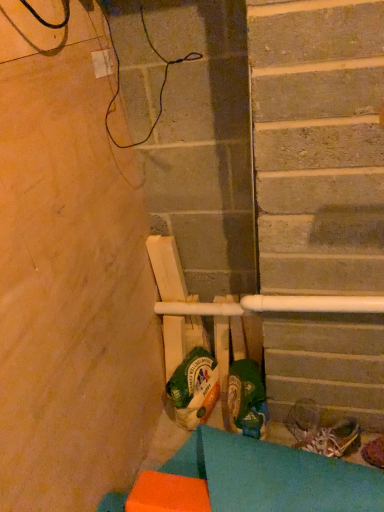
Describe the element at coordinates (246, 398) in the screenshot. I see `green fabric shoe at center, the 3th footwear when ordered from right to left` at that location.

The width and height of the screenshot is (384, 512). I want to click on orange foam block at lower left, so click(x=274, y=476).

You are a GUI agent. You are given a task and a screenshot of the screen. Output one action in this format:
    pyautogui.click(x=<x>, y=<y>)
    Task: Click on the green fabric shoe at center, the 3th footwear when ordered from right to left
    The image size is (384, 512).
    Given the screenshot: What is the action you would take?
    pyautogui.click(x=246, y=398)

Could you tell me if green fabric shoe at center, the 1th footwear viewed from the left, is facing shiny metallic shoe at lower right, the third footwear in the left-to-right sequence?

No, green fabric shoe at center, the 1th footwear viewed from the left, is not facing towards shiny metallic shoe at lower right, the third footwear in the left-to-right sequence.

Considering the points (249, 396) and (374, 453), which point is behind, point (249, 396) or point (374, 453)?

The point (374, 453) is more distant.

From the image's perspective, which one is positioned higher, green fabric shoe at center, the 1th footwear viewed from the left, or shiny metallic shoe at lower right, the third footwear in the left-to-right sequence?

From the image's view, green fabric shoe at center, the 1th footwear viewed from the left, is above.

I want to click on the 2nd footwear above the shiny metallic shoe at lower right, the third footwear in the left-to-right sequence (from a real-world perspective), so click(246, 398).

From a real-world perspective, does shiny metallic shoes at lower right, the 2th footwear in the right-to-left sequence, sit lower than orange foam block at lower left?

Indeed, from a real-world perspective, shiny metallic shoes at lower right, the 2th footwear in the right-to-left sequence, is positioned beneath orange foam block at lower left.

Between point (309, 445) and point (290, 495), which one is positioned behind?

The point (309, 445) is farther.

Does green fabric shoe at center, the 1th footwear viewed from the left, have a greater height compared to orange foam block at lower left?

Yes.

Between green fabric shoe at center, the 1th footwear viewed from the left, and orange foam block at lower left, which one has larger width?

With larger width is orange foam block at lower left.

Relative to orange foam block at lower left, is green fabric shoe at center, the 1th footwear viewed from the left, in front or behind?

In the image, green fabric shoe at center, the 1th footwear viewed from the left, appears behind orange foam block at lower left.

Is orange foam block at lower left a part of green fabric shoe at center, the 3th footwear when ordered from right to left?

No, orange foam block at lower left is not surrounded by green fabric shoe at center, the 3th footwear when ordered from right to left.

Is green fabric shoe at center, the 3th footwear when ordered from right to left, at the back of shiny metallic shoes at lower right, the 2th footwear in the right-to-left sequence?

No, shiny metallic shoes at lower right, the 2th footwear in the right-to-left sequence, is not facing the opposite direction of green fabric shoe at center, the 3th footwear when ordered from right to left.

Identify the location of footwear to the left of shiny metallic shoes at lower right, the 2th footwear positioned from the left. (246, 398).

From a real-world perspective, which object rests below the other?

shiny metallic shoes at lower right, the 2th footwear in the right-to-left sequence, is physically lower.

Does shiny metallic shoes at lower right, the 2th footwear positioned from the left, appear on the right side of green fabric shoe at center, the 1th footwear viewed from the left?

Correct, you'll find shiny metallic shoes at lower right, the 2th footwear positioned from the left, to the right of green fabric shoe at center, the 1th footwear viewed from the left.

Is shiny metallic shoes at lower right, the 2th footwear in the right-to-left sequence, completely or partially inside shiny metallic shoe at lower right, which is counted as the first footwear, starting from the right?

No, shiny metallic shoe at lower right, which is counted as the first footwear, starting from the right, does not contain shiny metallic shoes at lower right, the 2th footwear in the right-to-left sequence.

Is shiny metallic shoe at lower right, which is counted as the first footwear, starting from the right, in contact with shiny metallic shoes at lower right, the 2th footwear in the right-to-left sequence?

No, shiny metallic shoe at lower right, which is counted as the first footwear, starting from the right, is not beside shiny metallic shoes at lower right, the 2th footwear in the right-to-left sequence.

Which is less distant, (364, 457) or (327, 429)?

Positioned in front is point (364, 457).

Is point (233, 401) less distant than point (320, 440)?

No.

From a real-world perspective, which object stands above the other?

In real-world perspective, green fabric shoe at center, the 3th footwear when ordered from right to left, is above.

Considering the sizes of green fabric shoe at center, the 3th footwear when ordered from right to left, and shiny metallic shoes at lower right, the 2th footwear positioned from the left, in the image, is green fabric shoe at center, the 3th footwear when ordered from right to left, bigger or smaller than shiny metallic shoes at lower right, the 2th footwear positioned from the left,?

green fabric shoe at center, the 3th footwear when ordered from right to left, is bigger than shiny metallic shoes at lower right, the 2th footwear positioned from the left.

In the scene shown: Does green fabric shoe at center, the 3th footwear when ordered from right to left, have a greater height compared to shiny metallic shoes at lower right, the 2th footwear positioned from the left?

Indeed, green fabric shoe at center, the 3th footwear when ordered from right to left, has a greater height compared to shiny metallic shoes at lower right, the 2th footwear positioned from the left.

Between shiny metallic shoe at lower right, the third footwear in the left-to-right sequence, and orange foam block at lower left, which one has smaller size?

Smaller between the two is shiny metallic shoe at lower right, the third footwear in the left-to-right sequence.

Is shiny metallic shoe at lower right, the third footwear in the left-to-right sequence, completely or partially outside of orange foam block at lower left?

Absolutely, shiny metallic shoe at lower right, the third footwear in the left-to-right sequence, is external to orange foam block at lower left.

Can you confirm if shiny metallic shoe at lower right, the third footwear in the left-to-right sequence, is shorter than orange foam block at lower left?

Correct, shiny metallic shoe at lower right, the third footwear in the left-to-right sequence, is not as tall as orange foam block at lower left.

Considering the sizes of objects shiny metallic shoe at lower right, which is counted as the first footwear, starting from the right, and orange foam block at lower left in the image provided, who is thinner, shiny metallic shoe at lower right, which is counted as the first footwear, starting from the right, or orange foam block at lower left?

With smaller width is shiny metallic shoe at lower right, which is counted as the first footwear, starting from the right.

You are a GUI agent. You are given a task and a screenshot of the screen. Output one action in this format:
    pyautogui.click(x=<x>, y=<y>)
    Task: Click on the footwear that is the 2nd one when counting leftward from the shiny metallic shoe at lower right, which is counted as the first footwear, starting from the right
    
    Given the screenshot: What is the action you would take?
    pyautogui.click(x=246, y=398)

Identify the location of footwear that is the 2nd one when counting rightward from the orange foam block at lower left. (320, 431).

From the image, which object appears to be nearer to shiny metallic shoes at lower right, the 2th footwear positioned from the left, orange foam block at lower left or shiny metallic shoe at lower right, the third footwear in the left-to-right sequence?

Among the two, shiny metallic shoe at lower right, the third footwear in the left-to-right sequence, is located nearer to shiny metallic shoes at lower right, the 2th footwear positioned from the left.

Estimate the real-world distances between objects in this image. Which object is closer to shiny metallic shoe at lower right, the third footwear in the left-to-right sequence, shiny metallic shoes at lower right, the 2th footwear in the right-to-left sequence, or orange foam block at lower left?

Among the two, shiny metallic shoes at lower right, the 2th footwear in the right-to-left sequence, is located nearer to shiny metallic shoe at lower right, the third footwear in the left-to-right sequence.

When comparing their distances from shiny metallic shoes at lower right, the 2th footwear in the right-to-left sequence, does green fabric shoe at center, the 3th footwear when ordered from right to left, or orange foam block at lower left seem closer?

green fabric shoe at center, the 3th footwear when ordered from right to left, is closer to shiny metallic shoes at lower right, the 2th footwear in the right-to-left sequence.

When comparing their distances from shiny metallic shoes at lower right, the 2th footwear in the right-to-left sequence, does green fabric shoe at center, the 1th footwear viewed from the left, or shiny metallic shoe at lower right, the third footwear in the left-to-right sequence, seem further?

Based on the image, green fabric shoe at center, the 1th footwear viewed from the left, appears to be further to shiny metallic shoes at lower right, the 2th footwear in the right-to-left sequence.

Looking at the image, which one is located closer to shiny metallic shoe at lower right, the third footwear in the left-to-right sequence, shiny metallic shoes at lower right, the 2th footwear positioned from the left, or green fabric shoe at center, the 1th footwear viewed from the left?

Based on the image, shiny metallic shoes at lower right, the 2th footwear positioned from the left, appears to be nearer to shiny metallic shoe at lower right, the third footwear in the left-to-right sequence.

Estimate the real-world distances between objects in this image. Which object is further from orange foam block at lower left, green fabric shoe at center, the 3th footwear when ordered from right to left, or shiny metallic shoes at lower right, the 2th footwear in the right-to-left sequence?

shiny metallic shoes at lower right, the 2th footwear in the right-to-left sequence, is further to orange foam block at lower left.

From the image, which object appears to be farther from shiny metallic shoe at lower right, which is counted as the first footwear, starting from the right, orange foam block at lower left or shiny metallic shoes at lower right, the 2th footwear in the right-to-left sequence?

orange foam block at lower left.

Considering their positions, is shiny metallic shoe at lower right, which is counted as the first footwear, starting from the right, positioned further to green fabric shoe at center, the 3th footwear when ordered from right to left, than orange foam block at lower left?

Based on the image, shiny metallic shoe at lower right, which is counted as the first footwear, starting from the right, appears to be further to green fabric shoe at center, the 3th footwear when ordered from right to left.

The image size is (384, 512). I want to click on footwear between green fabric shoe at center, the 3th footwear when ordered from right to left, and shiny metallic shoe at lower right, which is counted as the first footwear, starting from the right, in the horizontal direction, so click(x=320, y=431).